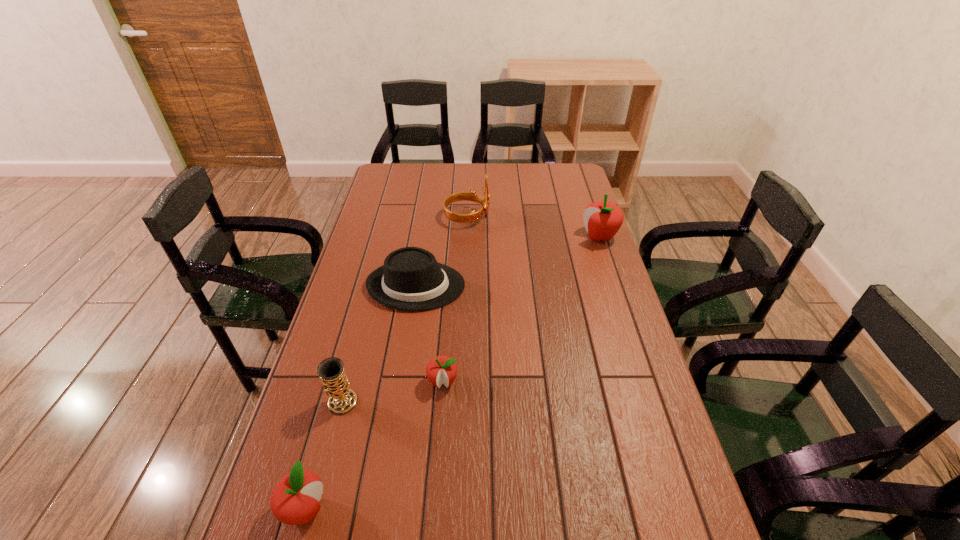
You are a GUI agent. You are given a task and a screenshot of the screen. Output one action in this format:
    pyautogui.click(x=<x>, y=<y>)
    Task: Click on the spot to insert another apple for uniform distribution
    The height and width of the screenshot is (540, 960).
    Given the screenshot: What is the action you would take?
    pyautogui.click(x=534, y=297)